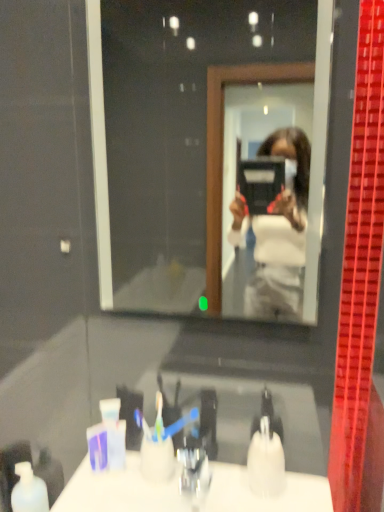
I want to click on white matte bottle at lower left, so click(29, 490).

Describe the element at coordinates (29, 490) in the screenshot. I see `white matte bottle at lower left` at that location.

In order to face white glossy counter top at lower center, should I rotate leftwards or rightwards?

Turn left approximately 0.001 degrees to face it.

I want to click on translucent plastic soap dispenser at lower center, so 266,462.

This screenshot has height=512, width=384. Identify the location of white matte bottle at lower left. (29, 490).

Can you confirm if clear glass mirror at center is shorter than white glossy counter top at lower center?

No.

Considering the relative positions of clear glass mirror at center and white glossy counter top at lower center in the image provided, is clear glass mirror at center to the left or to the right of white glossy counter top at lower center?

From the image, it's evident that clear glass mirror at center is to the right of white glossy counter top at lower center.

I want to click on counter top below the clear glass mirror at center (from a real-world perspective), so [x=120, y=490].

Looking at their sizes, would you say clear glass mirror at center is wider or thinner than white glossy counter top at lower center?

Clearly, clear glass mirror at center has less width compared to white glossy counter top at lower center.

From a real-world perspective, is white matte bottle at lower left over translucent plastic soap dispenser at lower center?

No, from a real-world perspective, white matte bottle at lower left is not above translucent plastic soap dispenser at lower center.

Between white matte bottle at lower left and translucent plastic soap dispenser at lower center, which one has less height?

translucent plastic soap dispenser at lower center.

Is translucent plastic soap dispenser at lower center inside white matte bottle at lower left?

That's incorrect, translucent plastic soap dispenser at lower center is not inside white matte bottle at lower left.

Is there a large distance between white matte bottle at lower left and translucent plastic soap dispenser at lower center?

They are positioned close to each other.

Considering the relative sizes of translucent plastic soap dispenser at lower center and white glossy counter top at lower center in the image provided, is translucent plastic soap dispenser at lower center bigger than white glossy counter top at lower center?

No, translucent plastic soap dispenser at lower center is not bigger than white glossy counter top at lower center.

Is point (275, 449) positioned behind point (122, 470)?

No, it is in front of (122, 470).

From a real-world perspective, which object rests below the other?

white matte bottle at lower left is physically lower.

Is white glossy counter top at lower center not inside white matte bottle at lower left?

white glossy counter top at lower center lies outside white matte bottle at lower left's area.

Considering the sizes of objects white glossy counter top at lower center and white matte bottle at lower left in the image provided, who is shorter, white glossy counter top at lower center or white matte bottle at lower left?

white glossy counter top at lower center is shorter.

Can you confirm if white matte bottle at lower left is taller than white glossy counter top at lower center?

Yes, white matte bottle at lower left is taller than white glossy counter top at lower center.

Does white matte bottle at lower left have a greater width compared to white glossy counter top at lower center?

In fact, white matte bottle at lower left might be narrower than white glossy counter top at lower center.

Is the surface of white matte bottle at lower left in direct contact with white glossy counter top at lower center?

No, white matte bottle at lower left is not next to white glossy counter top at lower center.

Between white matte bottle at lower left and white glossy counter top at lower center, which one has larger size?

white glossy counter top at lower center.

What's the angular difference between translucent plastic soap dispenser at lower center and white matte bottle at lower left's facing directions?

The facing directions of translucent plastic soap dispenser at lower center and white matte bottle at lower left are 40.3 degrees apart.

Is translucent plastic soap dispenser at lower center to the right of white matte bottle at lower left from the viewer's perspective?

Correct, you'll find translucent plastic soap dispenser at lower center to the right of white matte bottle at lower left.

In terms of size, does translucent plastic soap dispenser at lower center appear bigger or smaller than white matte bottle at lower left?

Considering their sizes, translucent plastic soap dispenser at lower center takes up less space than white matte bottle at lower left.

The width and height of the screenshot is (384, 512). In the image, there is a translucent plastic soap dispenser at lower center. Find the location of `mouthwash below it (from a real-world perspective)`. mouthwash below it (from a real-world perspective) is located at coordinates (29, 490).

Consider the image. Is white glossy counter top at lower center facing away from translucent plastic soap dispenser at lower center?

white glossy counter top at lower center is not turned away from translucent plastic soap dispenser at lower center.

How many degrees apart are the facing directions of white glossy counter top at lower center and translucent plastic soap dispenser at lower center?

1.48 degrees separate the facing orientations of white glossy counter top at lower center and translucent plastic soap dispenser at lower center.

Identify the location of toiletry above the white glossy counter top at lower center (from a real-world perspective). This screenshot has width=384, height=512. (266, 462).

From a real-world perspective, which object rests below the other?

In real-world perspective, white glossy counter top at lower center is lower.

Find the location of a particular element. counter top below the clear glass mirror at center (from the image's perspective) is located at coordinates (120, 490).

At what (x,y) coordinates should I click in order to perform the action: click on mouthwash that is under the translucent plastic soap dispenser at lower center (from a real-world perspective). Please return your answer as a coordinate pair (x, y). This screenshot has height=512, width=384. Looking at the image, I should click on (29, 490).

From the image, which object appears to be farther from white matte bottle at lower left, clear glass mirror at center or translucent plastic soap dispenser at lower center?

Based on the image, clear glass mirror at center appears to be further to white matte bottle at lower left.

Estimate the real-world distances between objects in this image. Which object is further from translucent plastic soap dispenser at lower center, white glossy counter top at lower center or clear glass mirror at center?

Among the two, clear glass mirror at center is located further to translucent plastic soap dispenser at lower center.

Looking at this image, estimate the real-world distances between objects in this image. Which object is further from white glossy counter top at lower center, clear glass mirror at center or translucent plastic soap dispenser at lower center?

Based on the image, clear glass mirror at center appears to be further to white glossy counter top at lower center.

Considering their positions, is translucent plastic soap dispenser at lower center positioned closer to white matte bottle at lower left than clear glass mirror at center?

Among the two, translucent plastic soap dispenser at lower center is located nearer to white matte bottle at lower left.

From the image, which object appears to be nearer to clear glass mirror at center, white matte bottle at lower left or translucent plastic soap dispenser at lower center?

Based on the image, translucent plastic soap dispenser at lower center appears to be nearer to clear glass mirror at center.

Which object lies nearer to the anchor point translucent plastic soap dispenser at lower center, clear glass mirror at center or white glossy counter top at lower center?

white glossy counter top at lower center is closer to translucent plastic soap dispenser at lower center.

Considering their positions, is translucent plastic soap dispenser at lower center positioned closer to white matte bottle at lower left than white glossy counter top at lower center?

Among the two, white glossy counter top at lower center is located nearer to white matte bottle at lower left.

In the scene shown: From the image, which object appears to be nearer to white matte bottle at lower left, clear glass mirror at center or white glossy counter top at lower center?

white glossy counter top at lower center lies closer to white matte bottle at lower left than the other object.

This screenshot has height=512, width=384. In order to click on counter top situated between white matte bottle at lower left and translucent plastic soap dispenser at lower center from left to right in this screenshot , I will do `click(120, 490)`.

The height and width of the screenshot is (512, 384). What are the coordinates of `toiletry between clear glass mirror at center and white matte bottle at lower left in the vertical direction` in the screenshot? It's located at (266, 462).

Where is `toiletry between clear glass mirror at center and white glossy counter top at lower center vertically`? Image resolution: width=384 pixels, height=512 pixels. toiletry between clear glass mirror at center and white glossy counter top at lower center vertically is located at coordinates (266, 462).

The width and height of the screenshot is (384, 512). Identify the location of counter top between clear glass mirror at center and white matte bottle at lower left vertically. (120, 490).